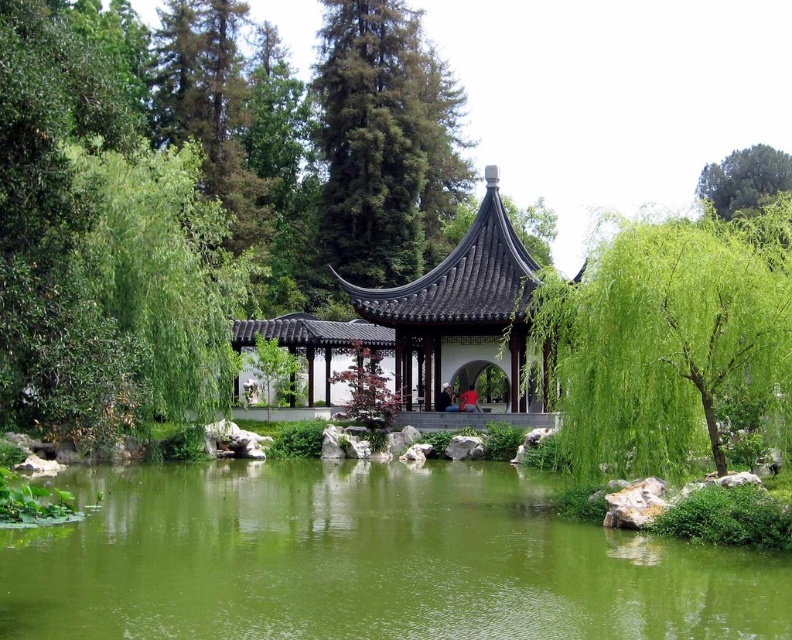
You are standing at the entrance of the pavilion and want to take a photo of the matte black person at center and the green leafy tree at upper right. Which object should you position to your left to frame both in the shot?

You should position the matte black person at center to your left since the green leafy tree at upper right is to the right of the matte black person at center, placing them in a left to right arrangement.

You are a photographer standing at the camera position. You want to capture a photo of the green textured tree at upper center. The camera has a maximum focus range of 80 meters. Will the tree be in focus?

The green textured tree at upper center is 83.75 meters from camera, which exceeds the camera maximum focus range of 80 meters. Therefore, the tree will not be in focus.

You are standing at the point marked as point (x=667, y=337) in the image. Looking around, you see a green leafy tree at center and the traditional Chinese pavilion. Which direction should you face to see the green leafy tree at center?

Since the green leafy tree at center is located at point (x=667, y=337), which is your current position, you are already facing the tree. However, based on the scene description, the pavilion is situated by the pond, and the tree is at the center. To face the tree, you should look towards the center of the image where it is positioned.